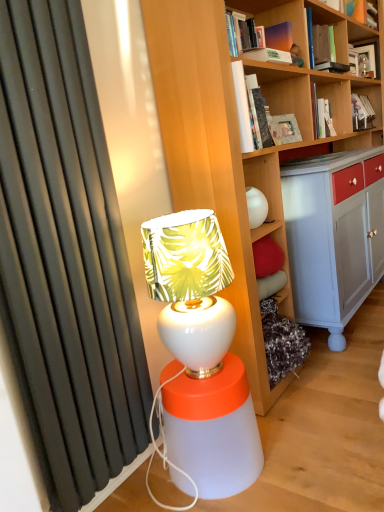
Question: In terms of height, does matte orange book at upper right, the first book positioned from the top, look taller or shorter compared to white glossy table lamp at center?

Choices:
 (A) short
 (B) tall

Answer: (A)

Question: Considering the relative positions of matte orange book at upper right, the first book positioned from the top, and white glossy table lamp at center in the image provided, is matte orange book at upper right, the first book positioned from the top, to the left or to the right of white glossy table lamp at center?

Choices:
 (A) left
 (B) right

Answer: (B)

Question: Which of these objects is positioned farthest from the hardcover book at upper center, which is counted as the 4th book, starting from the back?

Choices:
 (A) matte orange book at upper right, acting as the 6th book starting from the bottom
 (B) white glossy table lamp at center
 (C) hardcover book at upper center, which appears as the 1th book when ordered from the bottom
 (D) hardcover book at upper right, marked as the fourth book in a top-to-bottom arrangement
 (E) matte black frame at upper right, arranged as the second book when viewed from the top

Answer: (B)

Question: Based on their relative distances, which object is nearer to the hardcover book at upper right, which is counted as the 3th book, starting from the bottom?

Choices:
 (A) matte black frame at upper right, which is counted as the 6th book, starting from the front
 (B) hardcover book at upper right, the second book ordered from the bottom
 (C) hardcover book at upper center, the 1th book when ordered from front to back
 (D) matte orange book at upper right, arranged as the fourth book when viewed from the front
 (E) hardcover book at upper center, placed as the fourth book when sorted from bottom to top

Answer: (E)